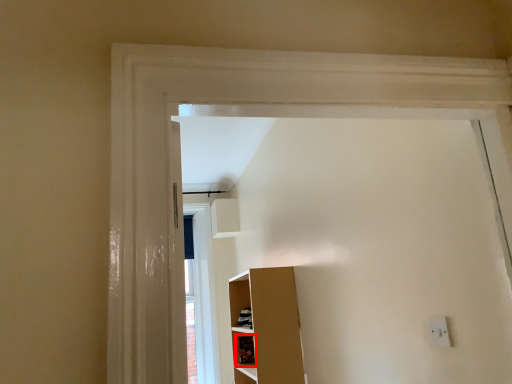
Question: From the image's perspective, what is the correct spatial relationship of cabinet (annotated by the red box) in relation to electric outlet?

Choices:
 (A) below
 (B) above

Answer: (A)